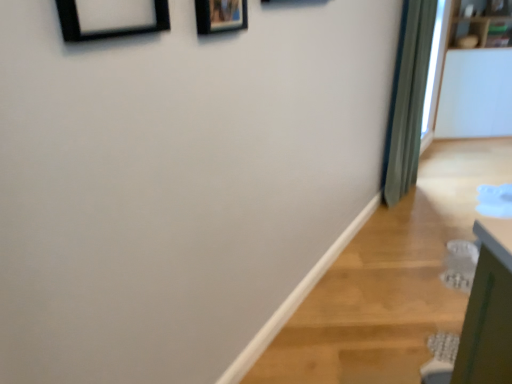
Measure the distance between point (75, 36) and camera.

32.36 inches.

Measure the distance between green fabric curtain at right and camera.

green fabric curtain at right is 2.62 meters away from camera.

The height and width of the screenshot is (384, 512). Identify the location of wooden picture frame at upper center, acting as the 1th picture frame starting from the right. (220, 16).

Looking at this image, choose the correct answer: Is green fabric curtain at right inside black matte picture frame at upper left, placed as the 1th picture frame when sorted from left to right, or outside it?

green fabric curtain at right is not inside black matte picture frame at upper left, placed as the 1th picture frame when sorted from left to right, it's outside.

From the image's perspective, is green fabric curtain at right under black matte picture frame at upper left, placed as the 2th picture frame when sorted from back to front?

Actually, green fabric curtain at right appears above black matte picture frame at upper left, placed as the 2th picture frame when sorted from back to front, in the image.

Based on the photo, how different are the orientations of green fabric curtain at right and black matte picture frame at upper left, marked as the 1th picture frame in a front-to-back arrangement, in degrees?

There is a 2.45-degree angle between the facing directions of green fabric curtain at right and black matte picture frame at upper left, marked as the 1th picture frame in a front-to-back arrangement.

Which of these two, green fabric curtain at right or black matte picture frame at upper left, placed as the 2th picture frame when sorted from back to front, stands taller?

green fabric curtain at right.

Locate an element on the screen. curtain below the black matte picture frame at upper left, acting as the 2th picture frame starting from the right (from a real-world perspective) is located at coordinates (408, 100).

Which point is more forward, (155, 19) or (392, 179)?

The point (155, 19) is more forward.

From a real-world perspective, is black matte picture frame at upper left, acting as the 2th picture frame starting from the right, located higher than green fabric curtain at right?

Yes.

Would you say black matte picture frame at upper left, placed as the 1th picture frame when sorted from left to right, is to the left or to the right of green fabric curtain at right in the picture?

In the image, black matte picture frame at upper left, placed as the 1th picture frame when sorted from left to right, appears on the left side of green fabric curtain at right.

Is green fabric curtain at right oriented towards wooden picture frame at upper center, acting as the 1th picture frame starting from the right?

No, green fabric curtain at right is not oriented towards wooden picture frame at upper center, acting as the 1th picture frame starting from the right.

Image resolution: width=512 pixels, height=384 pixels. What are the coordinates of `curtain located on the right of wooden picture frame at upper center, which ranks as the 2th picture frame in left-to-right order` in the screenshot? It's located at (408, 100).

From the image's perspective, which object appears higher, green fabric curtain at right or wooden picture frame at upper center, acting as the 1th picture frame starting from the right?

green fabric curtain at right is shown above in the image.

In terms of width, does wooden picture frame at upper center, placed as the second picture frame when sorted from front to back, look wider or thinner when compared to black matte picture frame at upper left, marked as the 1th picture frame in a front-to-back arrangement?

Result: wooden picture frame at upper center, placed as the second picture frame when sorted from front to back, is thinner than black matte picture frame at upper left, marked as the 1th picture frame in a front-to-back arrangement.

Is black matte picture frame at upper left, placed as the 2th picture frame when sorted from back to front, inside wooden picture frame at upper center, which ranks as the 2th picture frame in left-to-right order?

No, black matte picture frame at upper left, placed as the 2th picture frame when sorted from back to front, is not inside wooden picture frame at upper center, which ranks as the 2th picture frame in left-to-right order.

From the image's perspective, relative to black matte picture frame at upper left, placed as the 2th picture frame when sorted from back to front, is wooden picture frame at upper center, which ranks as the 2th picture frame in left-to-right order, above or below?

wooden picture frame at upper center, which ranks as the 2th picture frame in left-to-right order, is above black matte picture frame at upper left, placed as the 2th picture frame when sorted from back to front.

Who is taller, wooden picture frame at upper center, acting as the 1th picture frame starting from the right, or black matte picture frame at upper left, placed as the 2th picture frame when sorted from back to front?

wooden picture frame at upper center, acting as the 1th picture frame starting from the right, is taller.

Is wooden picture frame at upper center, which ranks as the 2th picture frame in left-to-right order, wider than green fabric curtain at right?

No, wooden picture frame at upper center, which ranks as the 2th picture frame in left-to-right order, is not wider than green fabric curtain at right.

Which is further, (x=233, y=3) or (x=418, y=145)?

The point (x=418, y=145) is more distant.

In the image, there is a wooden picture frame at upper center, placed as the second picture frame when sorted from front to back. What are the coordinates of `curtain below it (from a real-world perspective)` in the screenshot? It's located at (408, 100).

Looking at this image, which of these two, black matte picture frame at upper left, acting as the 2th picture frame starting from the right, or wooden picture frame at upper center, which ranks as the 2th picture frame in left-to-right order, is bigger?

black matte picture frame at upper left, acting as the 2th picture frame starting from the right.

Between black matte picture frame at upper left, marked as the 1th picture frame in a front-to-back arrangement, and wooden picture frame at upper center, acting as the 1th picture frame starting from the right, which one has larger width?

With larger width is black matte picture frame at upper left, marked as the 1th picture frame in a front-to-back arrangement.

What's the angular difference between black matte picture frame at upper left, placed as the 2th picture frame when sorted from back to front, and wooden picture frame at upper center, which is counted as the 1th picture frame, starting from the back,'s facing directions?

The angle between the facing direction of black matte picture frame at upper left, placed as the 2th picture frame when sorted from back to front, and the facing direction of wooden picture frame at upper center, which is counted as the 1th picture frame, starting from the back, is 0.426 degrees.

Where is `curtain below the black matte picture frame at upper left, marked as the 1th picture frame in a front-to-back arrangement (from a real-world perspective)`? curtain below the black matte picture frame at upper left, marked as the 1th picture frame in a front-to-back arrangement (from a real-world perspective) is located at coordinates (408, 100).

Locate an element on the screen. curtain behind the black matte picture frame at upper left, placed as the 2th picture frame when sorted from back to front is located at coordinates pyautogui.click(x=408, y=100).

Consider the image. Based on their spatial positions, is black matte picture frame at upper left, placed as the 1th picture frame when sorted from left to right, or green fabric curtain at right further from wooden picture frame at upper center, which ranks as the 2th picture frame in left-to-right order?

green fabric curtain at right.

When comparing their distances from black matte picture frame at upper left, placed as the 1th picture frame when sorted from left to right, does green fabric curtain at right or wooden picture frame at upper center, acting as the 1th picture frame starting from the right, seem closer?

wooden picture frame at upper center, acting as the 1th picture frame starting from the right, is positioned closer to the anchor black matte picture frame at upper left, placed as the 1th picture frame when sorted from left to right.

Which object lies further to the anchor point wooden picture frame at upper center, acting as the 1th picture frame starting from the right, green fabric curtain at right or black matte picture frame at upper left, acting as the 2th picture frame starting from the right?

green fabric curtain at right lies further to wooden picture frame at upper center, acting as the 1th picture frame starting from the right, than the other object.

Considering their positions, is wooden picture frame at upper center, placed as the second picture frame when sorted from front to back, positioned further to green fabric curtain at right than black matte picture frame at upper left, marked as the 1th picture frame in a front-to-back arrangement?

The object further to green fabric curtain at right is black matte picture frame at upper left, marked as the 1th picture frame in a front-to-back arrangement.

Which object lies nearer to the anchor point green fabric curtain at right, black matte picture frame at upper left, placed as the 1th picture frame when sorted from left to right, or wooden picture frame at upper center, placed as the second picture frame when sorted from front to back?

Based on the image, wooden picture frame at upper center, placed as the second picture frame when sorted from front to back, appears to be nearer to green fabric curtain at right.

Which object lies further to the anchor point black matte picture frame at upper left, acting as the 2th picture frame starting from the right, wooden picture frame at upper center, which is counted as the 1th picture frame, starting from the back, or green fabric curtain at right?

Based on the image, green fabric curtain at right appears to be further to black matte picture frame at upper left, acting as the 2th picture frame starting from the right.

Image resolution: width=512 pixels, height=384 pixels. In order to click on picture frame between black matte picture frame at upper left, placed as the 2th picture frame when sorted from back to front, and green fabric curtain at right in the front-back direction in this screenshot , I will do `click(220, 16)`.